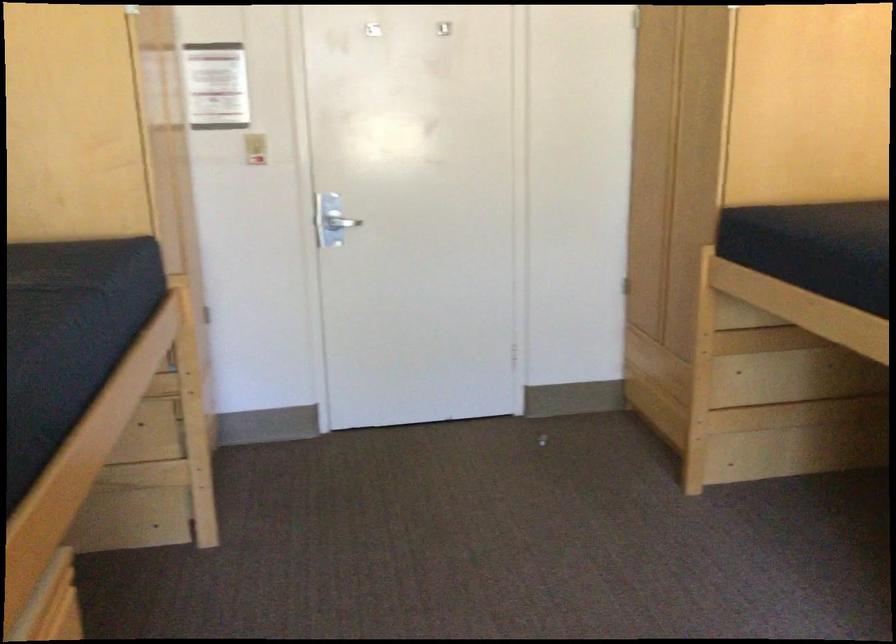
The height and width of the screenshot is (644, 896). Describe the element at coordinates (255, 147) in the screenshot. I see `the white light switch` at that location.